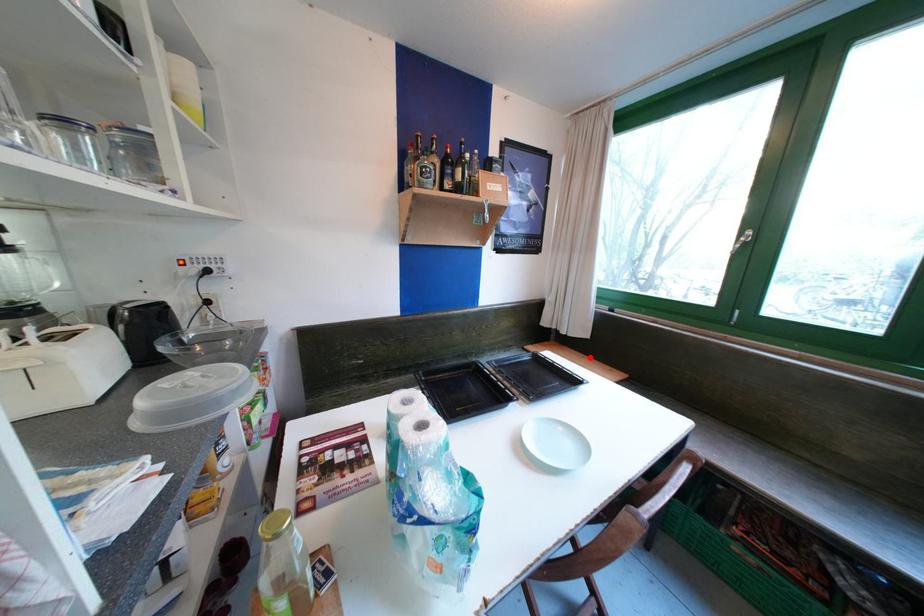
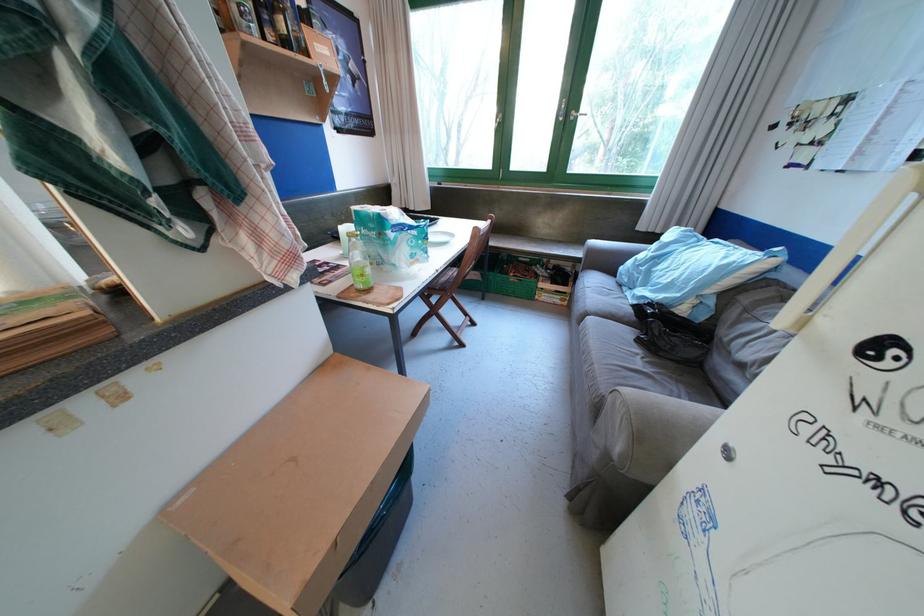
Question: I am providing you with two images of the same scene from different viewpoints. A red point is marked on the first image. Is the red point's position out of view in image 2?

Choices:
 (A) Yes
 (B) No

Answer: (A)